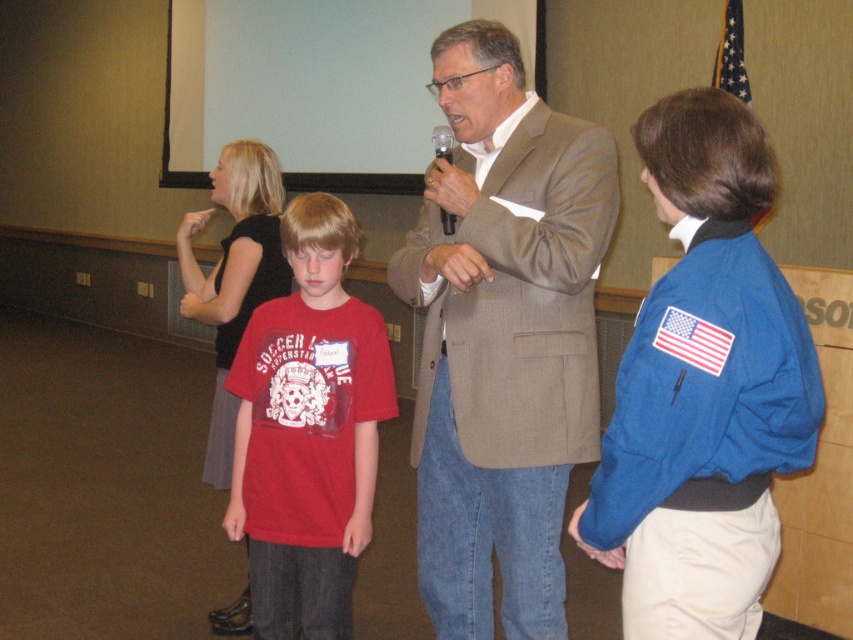
You are standing at the point labeled point (x=444, y=220) and want to move to the point labeled point (x=491, y=440). Is the path between these two points clear of any obstacles?

Yes, the path between point (x=444, y=220) and point (x=491, y=440) is clear because point (x=491, y=440) is in front of point (x=444, y=220), indicating no obstruction between them.

Where is the light brown textured suit at center located in the image?

The light brown textured suit at center is located at point 0.528 on the x axis and 0.591 on the y axis.